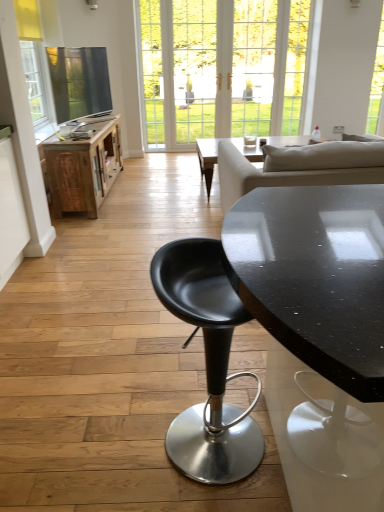
Find the location of a particular element. spots to the right of wooden cabinet at left is located at coordinates (153, 188).